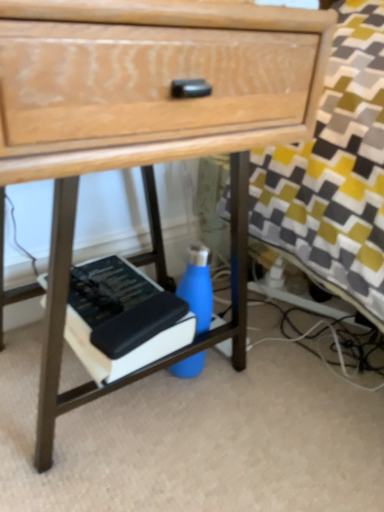
Question: Choose the correct answer: Is blue matte water bottle at center inside hardcover book at lower center or outside it?

Choices:
 (A) inside
 (B) outside

Answer: (B)

Question: Is blue matte water bottle at center wider or thinner than hardcover book at lower center?

Choices:
 (A) wide
 (B) thin

Answer: (B)

Question: From the image's perspective, is blue matte water bottle at center positioned above or below hardcover book at lower center?

Choices:
 (A) above
 (B) below

Answer: (B)

Question: From a real-world perspective, is hardcover book at lower center positioned above or below blue matte water bottle at center?

Choices:
 (A) above
 (B) below

Answer: (A)

Question: Is hardcover book at lower center taller or shorter than blue matte water bottle at center?

Choices:
 (A) tall
 (B) short

Answer: (B)

Question: Is hardcover book at lower center bigger or smaller than blue matte water bottle at center?

Choices:
 (A) small
 (B) big

Answer: (B)

Question: Considering the positions of point (82, 322) and point (198, 250), is point (82, 322) closer or farther from the camera than point (198, 250)?

Choices:
 (A) farther
 (B) closer

Answer: (A)